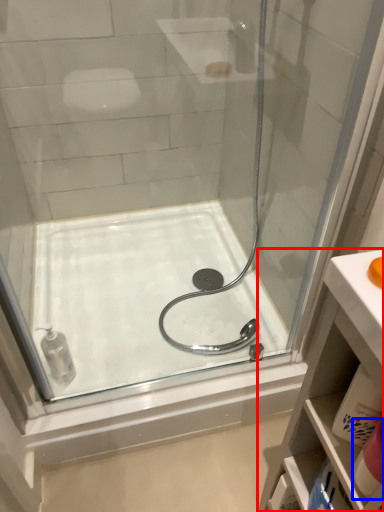
Question: Among these objects, which one is nearest to the camera, bathroom cabinet (highlighted by a red box) or toiletry (highlighted by a blue box)?

Choices:
 (A) bathroom cabinet
 (B) toiletry

Answer: (A)